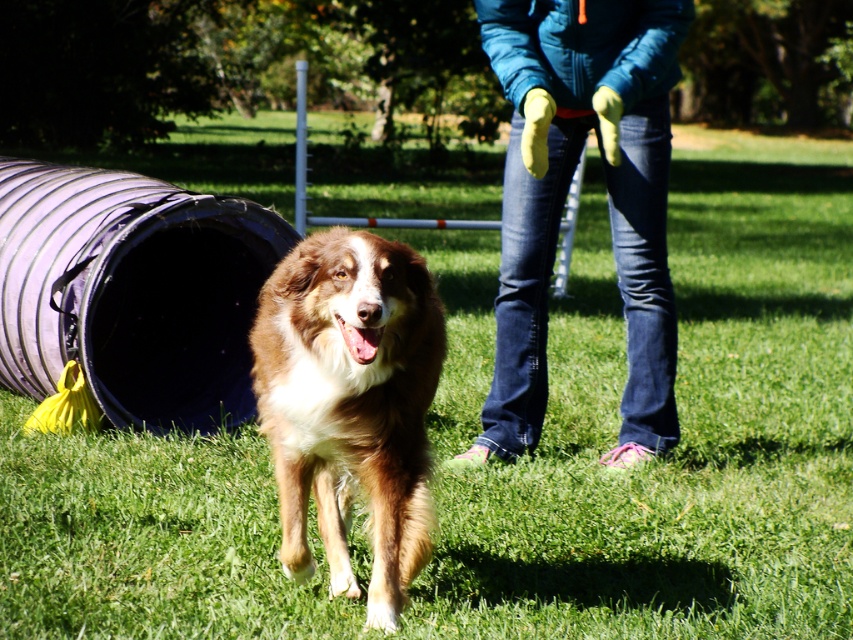
Is rubberized purple tunnel at left bigger than brown fluffy dog at center?

Yes, rubberized purple tunnel at left is bigger than brown fluffy dog at center.

Which is in front, point (27, 356) or point (438, 374)?

Point (438, 374) is in front.

Does point (97, 300) lie behind point (361, 305)?

Yes.

Locate an element on the screen. The width and height of the screenshot is (853, 640). rubberized purple tunnel at left is located at coordinates (131, 291).

Is the position of denim jeans at center less distant than that of rubberized purple tunnel at left?

Yes, denim jeans at center is in front of rubberized purple tunnel at left.

Who is more distant from viewer, (631, 397) or (94, 278)?

Positioned behind is point (94, 278).

Where is `denim jeans at center`? denim jeans at center is located at coordinates (564, 196).

Does denim jeans at center lie in front of brown fluffy dog at center?

No, denim jeans at center is further to the viewer.

Which is more to the right, denim jeans at center or brown fluffy dog at center?

From the viewer's perspective, denim jeans at center appears more on the right side.

Who is more distant from viewer, (x=524, y=3) or (x=368, y=522)?

The point (x=524, y=3) is more distant.

Identify the location of denim jeans at center. (564, 196).